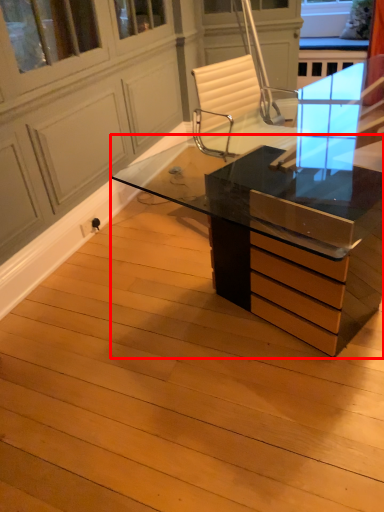
Question: From the image, what is the correct spatial relationship of desk (annotated by the red box) in relation to screen door?

Choices:
 (A) left
 (B) right

Answer: (B)